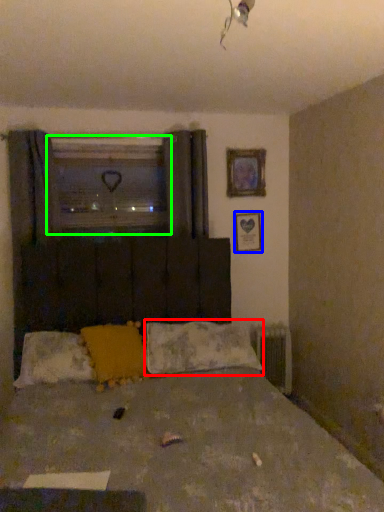
Question: Which is farther away from pillow (highlighted by a red box)? picture frame (highlighted by a blue box) or window screen (highlighted by a green box)?

Choices:
 (A) picture frame
 (B) window screen

Answer: (B)